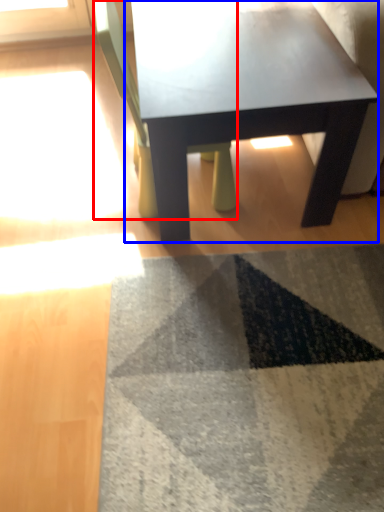
Question: Which object appears closest to the camera in this image, chair (highlighted by a red box) or coffee table (highlighted by a blue box)?

Choices:
 (A) chair
 (B) coffee table

Answer: (A)